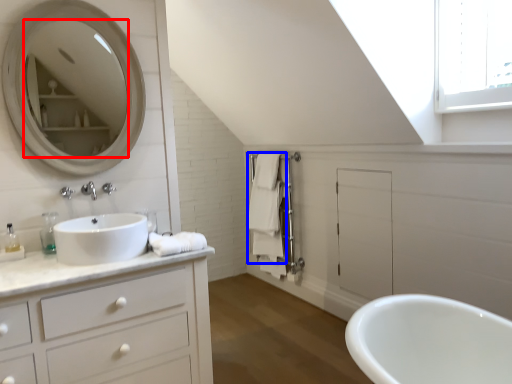
Question: Which point is further to the camera, mirror (highlighted by a red box) or bath towel (highlighted by a blue box)?

Choices:
 (A) mirror
 (B) bath towel

Answer: (B)